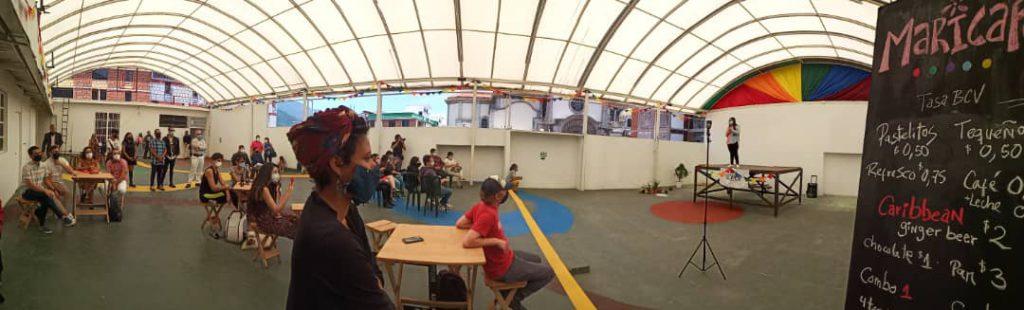
Identify the location of tables. The width and height of the screenshot is (1024, 310). (99, 181), (243, 187), (436, 245), (379, 224).